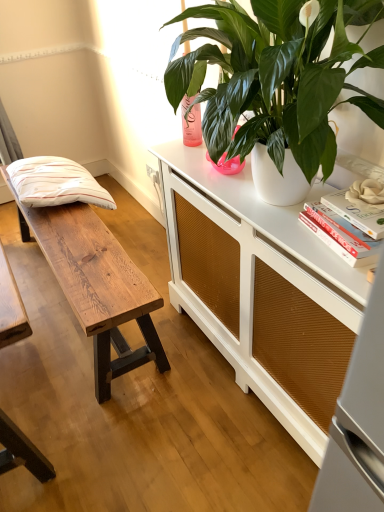
Where is `free space to the left of white textured cabinet at center`? This screenshot has height=512, width=384. free space to the left of white textured cabinet at center is located at coordinates (126, 398).